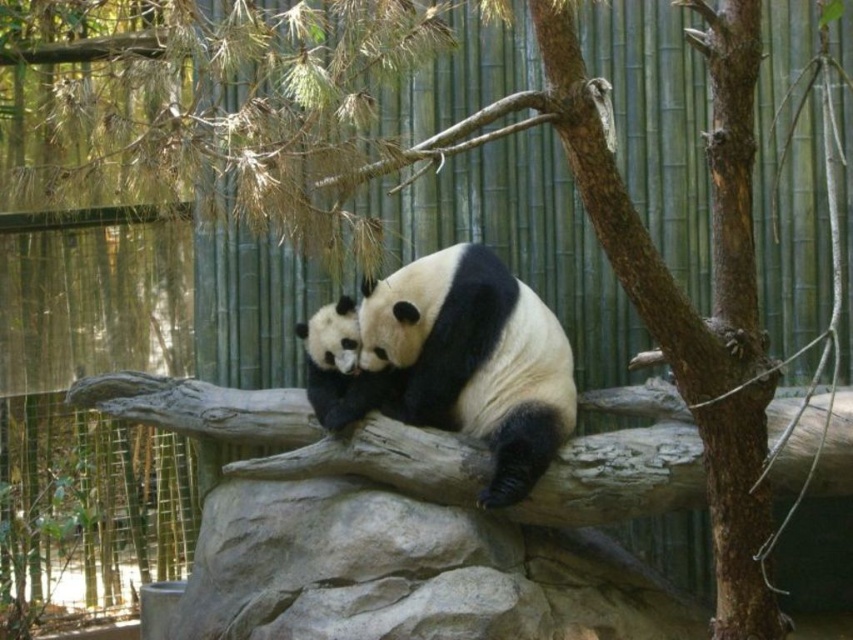
You are a zookeeper who needs to place a feeding bowl between the two pandas. The bowl has a diameter of 10 inches. Will there be enough space between the black fur panda at center and the black fuzzy panda at center to place the bowl?

The black fur panda at center and black fuzzy panda at center are 10.89 inches apart. Since the bowl requires 10 inches of space, there is enough space to place the bowl between them.

You are a zookeeper planning to place a feeding station between the brown rough tree trunk at center right and the black fuzzy panda at center. Based on their sizes, which object should the feeding station be closer to?

The brown rough tree trunk at center right is bigger than the black fuzzy panda at center, so the feeding station should be placed closer to the black fuzzy panda at center to ensure there is enough space between them.

You are a zookeeper who needs to place a feeding tray between the brown rough tree trunk at center right and the black fuzzy panda at center. The tray requires a minimum of 5 feet of space to be placed safely. Can you fit the feeding tray between them?

The brown rough tree trunk at center right and the black fuzzy panda at center are 7.00 feet apart, so yes, the feeding tray can be placed between them since the distance is more than the required 5 feet.